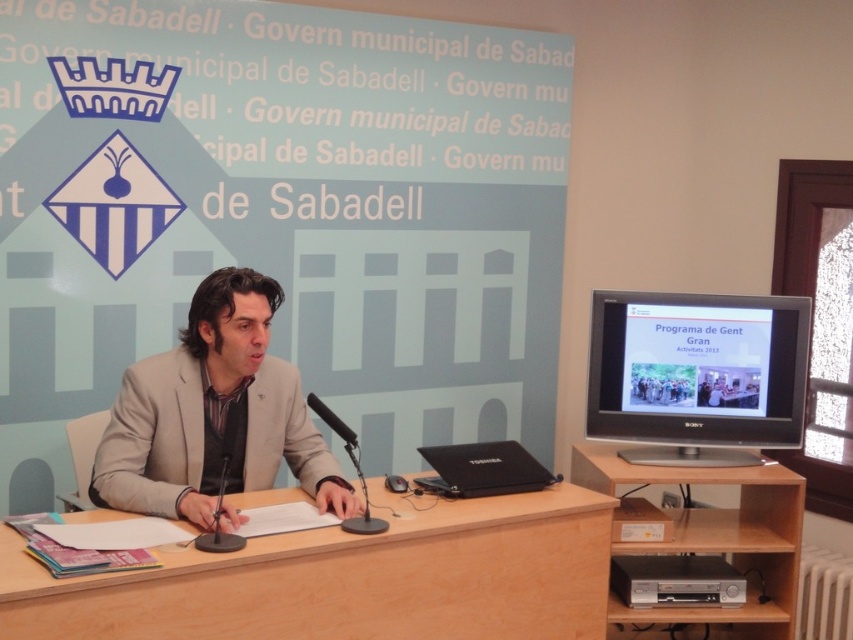
Question: In this image, where is matte black laptop at center located relative to black plastic microphone at center?

Choices:
 (A) above
 (B) below

Answer: (B)

Question: Which is farther from the beige fabric suit at center?

Choices:
 (A) black plastic microphone at center
 (B) matte black laptop at center
 (C) matte black monitor at right

Answer: (C)

Question: Which object appears closest to the camera in this image?

Choices:
 (A) matte black laptop at center
 (B) matte black monitor at right

Answer: (A)

Question: Can you confirm if wooden table at center is wider than black plastic microphone at center?

Choices:
 (A) no
 (B) yes

Answer: (B)

Question: Which point is farther to the camera?

Choices:
 (A) black plastic microphone at center
 (B) matte black laptop at center

Answer: (B)

Question: Is the position of beige fabric suit at center less distant than that of matte black laptop at center?

Choices:
 (A) yes
 (B) no

Answer: (A)